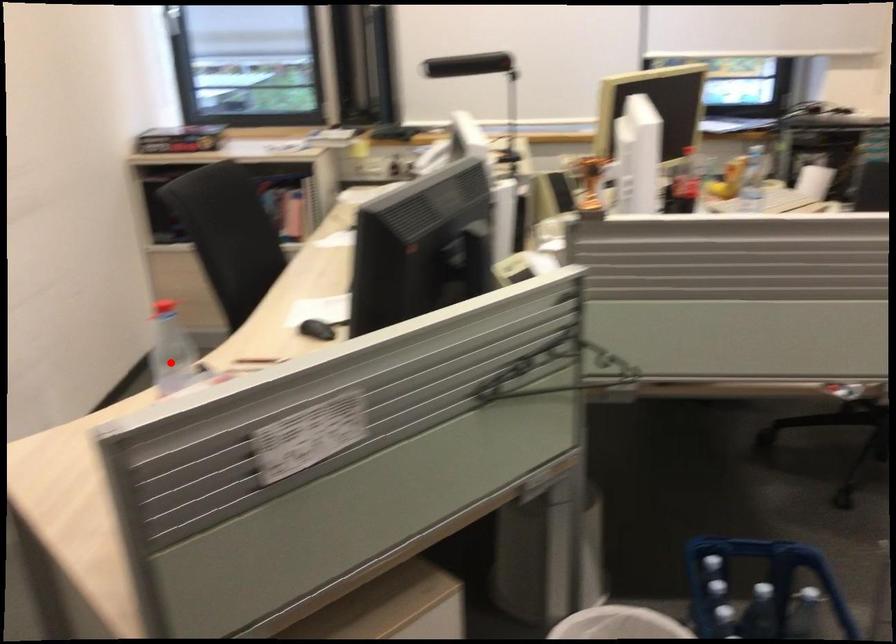
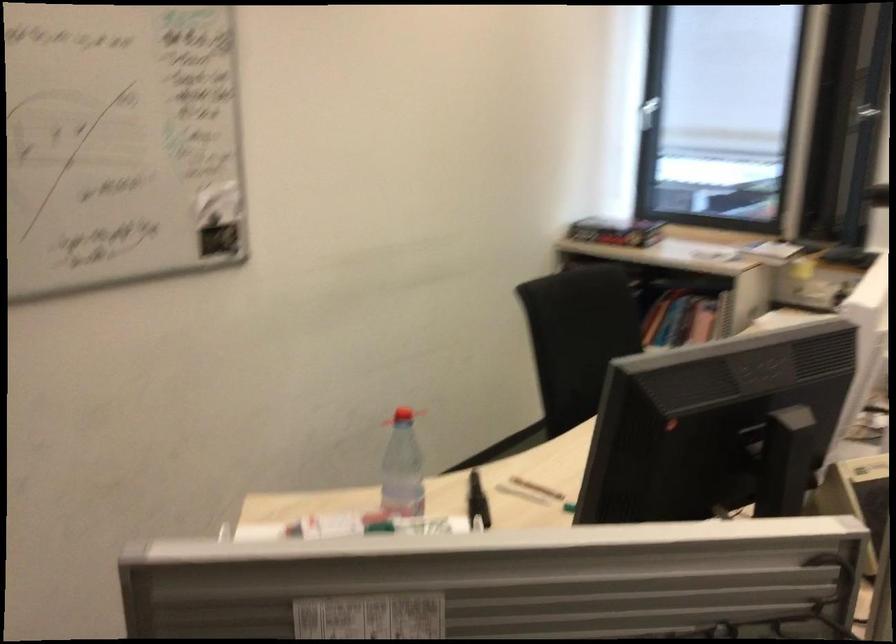
Find the pixel in the second image that matches the highlighted location in the first image.

(401, 469)